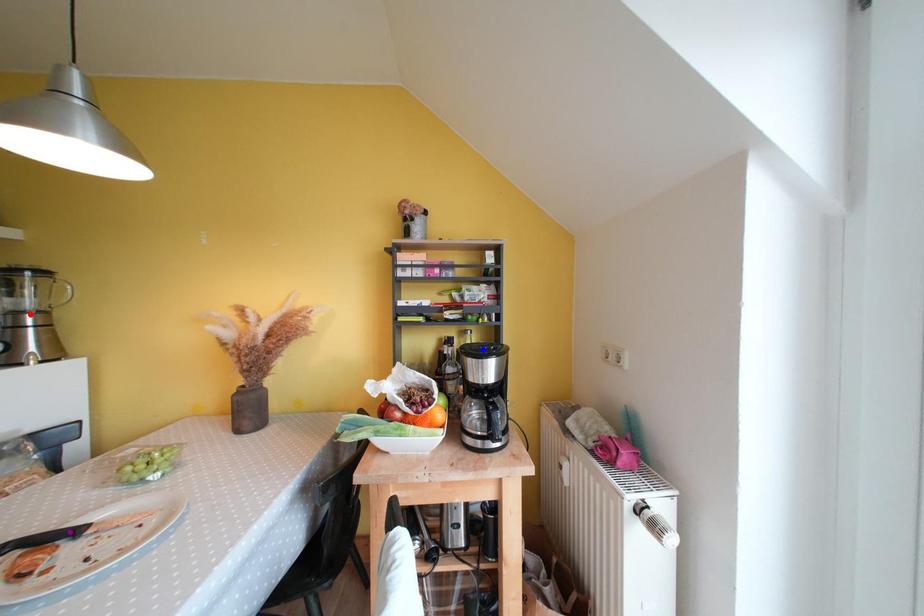
Order these from nearest to farthest:
blue point, red point, purple point

1. blue point
2. red point
3. purple point